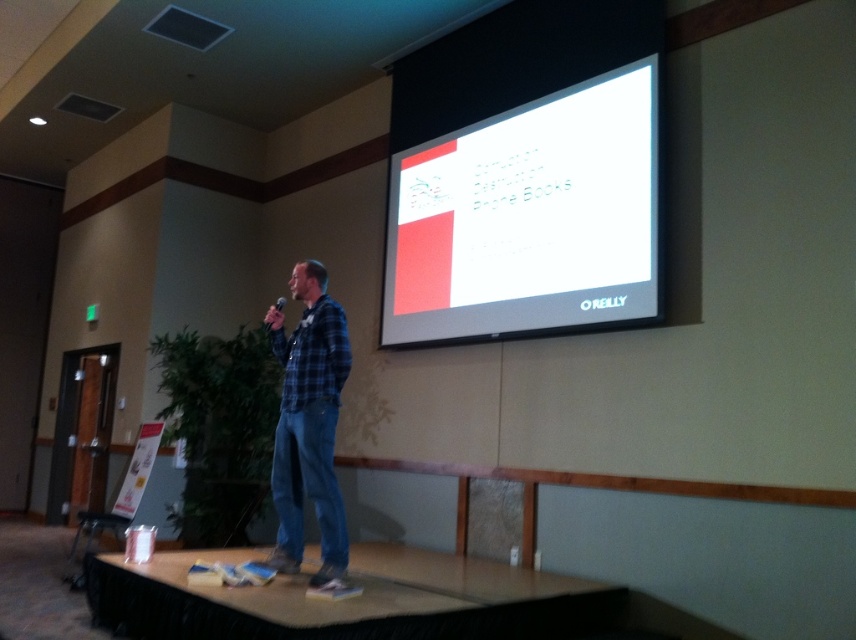
Question: Is white glossy projection screen at upper center positioned at the back of matte black microphone at center?

Choices:
 (A) yes
 (B) no

Answer: (B)

Question: Where is white glossy projection screen at upper center located in relation to matte black microphone at center in the image?

Choices:
 (A) below
 (B) above

Answer: (B)

Question: Does white glossy projection screen at upper center have a lesser width compared to blue plaid shirt at center?

Choices:
 (A) no
 (B) yes

Answer: (A)

Question: Which object is farther from the camera taking this photo?

Choices:
 (A) matte black microphone at center
 (B) white glossy projection screen at upper center
 (C) blue plaid shirt at center

Answer: (A)

Question: Based on their relative distances, which object is farther from the white glossy projection screen at upper center?

Choices:
 (A) blue plaid shirt at center
 (B) matte black microphone at center

Answer: (B)

Question: Estimate the real-world distances between objects in this image. Which object is farther from the matte black microphone at center?

Choices:
 (A) white glossy projection screen at upper center
 (B) blue plaid shirt at center

Answer: (B)